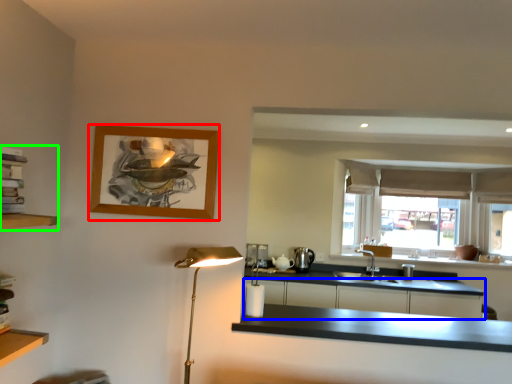
Question: Which object is the closest to the picture frame (highlighted by a red box)? Choose among these: cabinetry (highlighted by a blue box) or shelf (highlighted by a green box).

Choices:
 (A) cabinetry
 (B) shelf

Answer: (B)